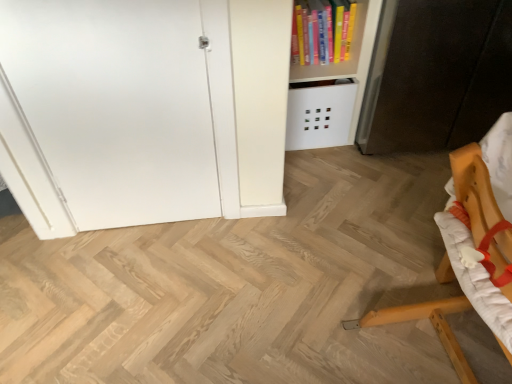
Locate an element on the screen. free spot to the right of white matte door at left is located at coordinates click(x=228, y=243).